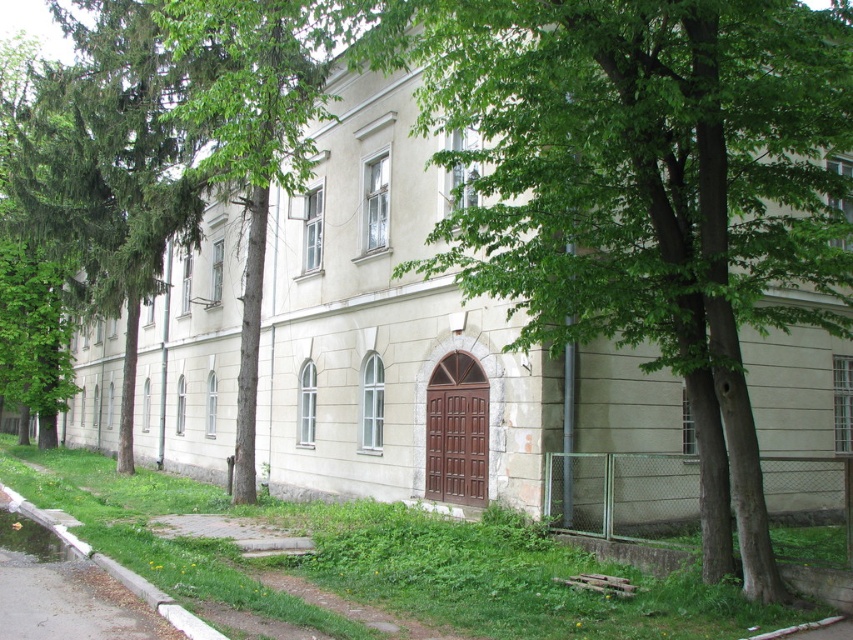
Question: Does gray concrete sidewalk at lower left have a larger size compared to white concrete curb at lower left?

Choices:
 (A) no
 (B) yes

Answer: (A)

Question: Which point appears farthest from the camera in this image?

Choices:
 (A) (35, 518)
 (B) (109, 627)

Answer: (A)

Question: From the image, what is the correct spatial relationship of green leafy tree at center in relation to gray concrete sidewalk at lower left?

Choices:
 (A) right
 (B) left

Answer: (A)

Question: Does green leafy tree at center appear under gray concrete sidewalk at lower left?

Choices:
 (A) yes
 (B) no

Answer: (B)

Question: Which object appears farthest from the camera in this image?

Choices:
 (A) white concrete curb at lower left
 (B) green leafy tree at center
 (C) gray concrete sidewalk at lower left

Answer: (B)

Question: Based on their relative distances, which object is farther from the white concrete curb at lower left?

Choices:
 (A) green leafy tree at center
 (B) gray concrete sidewalk at lower left

Answer: (A)